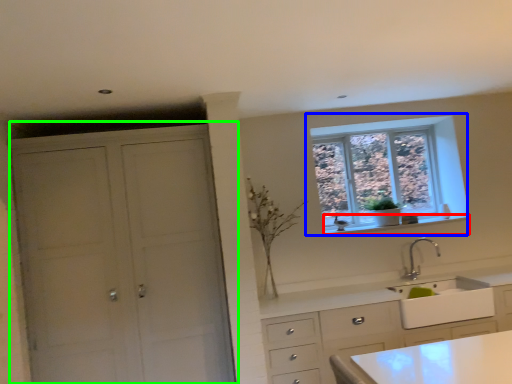
Question: Which object is the farthest from window sill (highlighted by a red box)? Choose among these: window (highlighted by a blue box) or cupboard (highlighted by a green box).

Choices:
 (A) window
 (B) cupboard

Answer: (B)